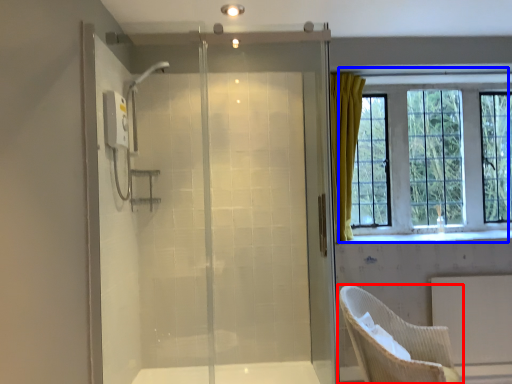
Question: Which point is further to the camera, chair (highlighted by a red box) or window (highlighted by a blue box)?

Choices:
 (A) chair
 (B) window

Answer: (B)